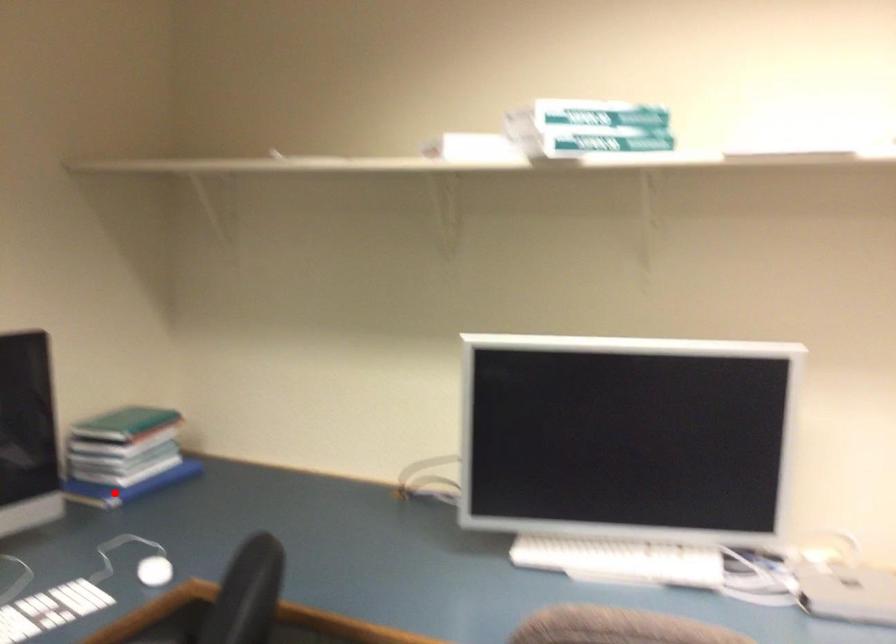
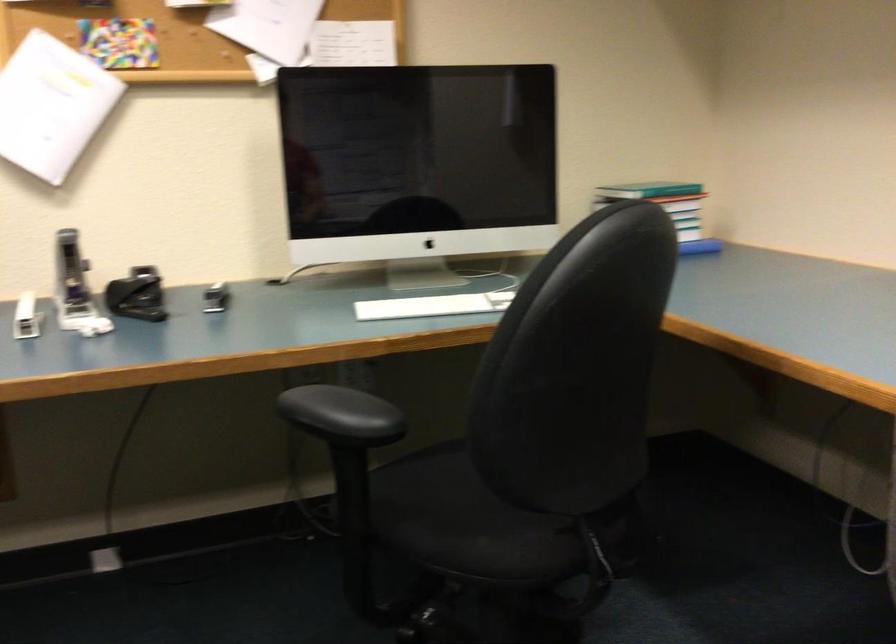
Question: I am providing you with two images of the same scene from different viewpoints. A red point is marked on the first image. Can you still see the location of the red point in image 2?

Choices:
 (A) Yes
 (B) No

Answer: (B)